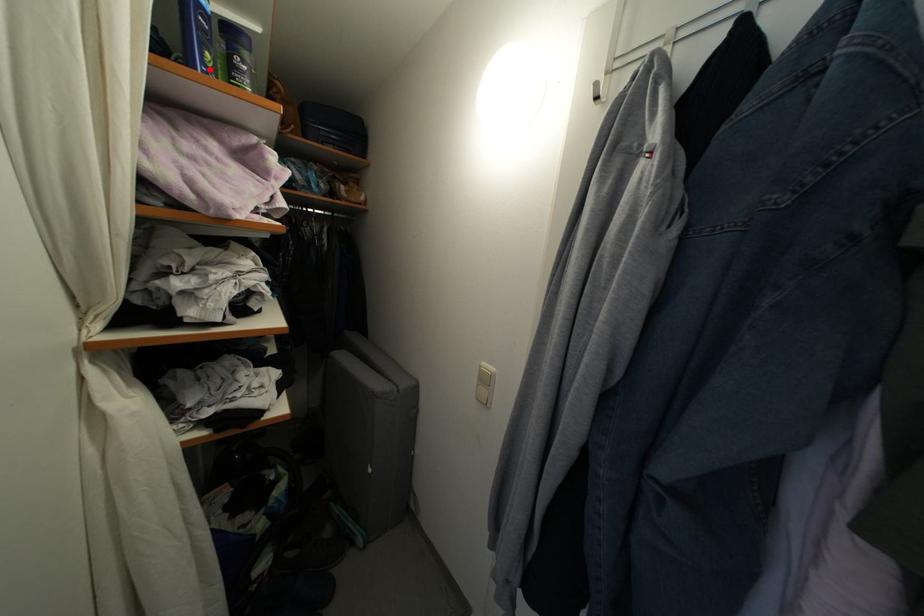
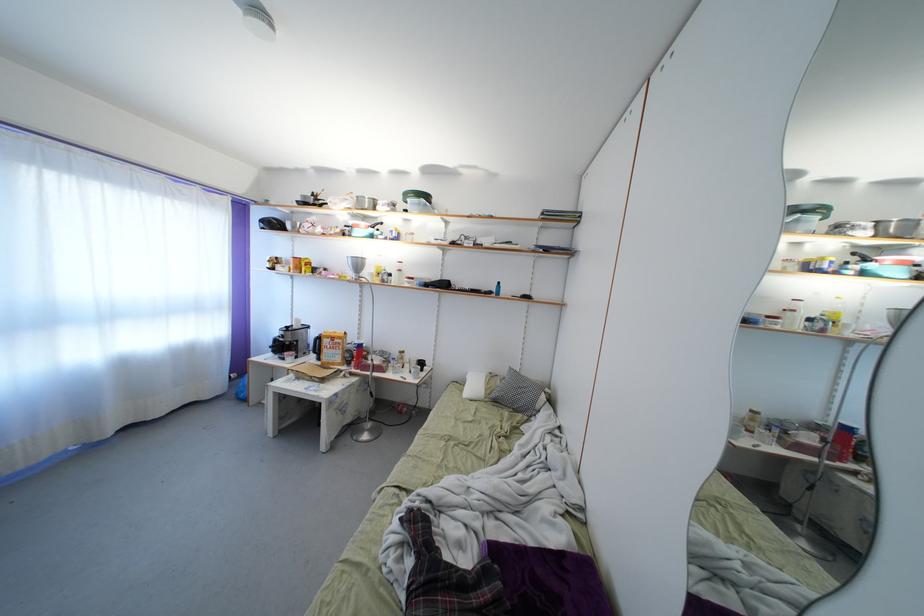
Question: I am providing you with two images of the same scene from different viewpoints. A red point is marked on the first image. Is the red point's position out of view in image 2?

Choices:
 (A) Yes
 (B) No

Answer: (A)